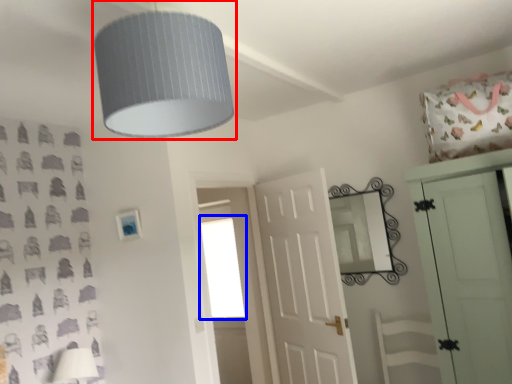
Question: Which object is closer to the camera taking this photo, lamp (highlighted by a red box) or window (highlighted by a blue box)?

Choices:
 (A) lamp
 (B) window

Answer: (A)